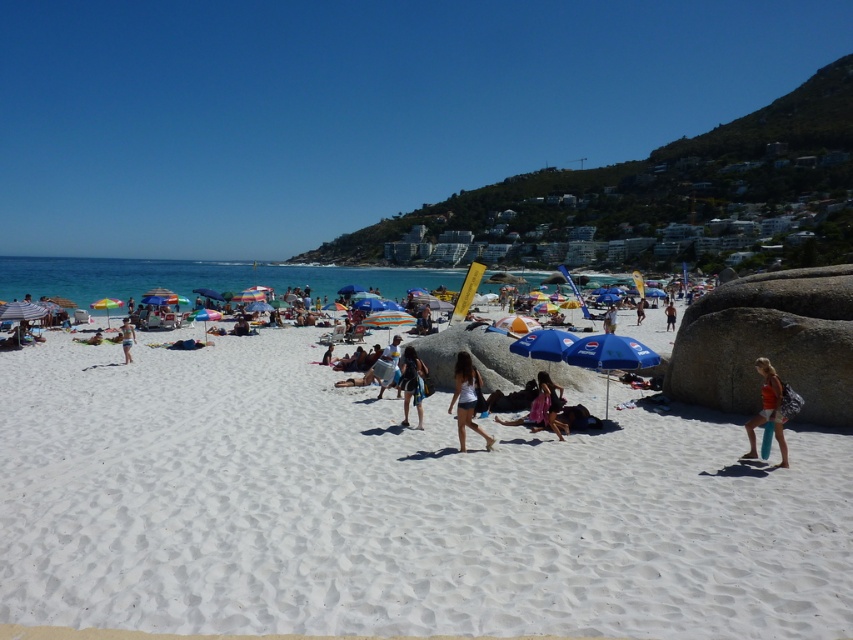
You are a photographer trying to capture a candid shot of the beachgoers. You notice the white cotton shirt at center and the dark blue shorts at center. Which clothing item would require a closer focus to capture details clearly?

The white cotton shirt at center occupies less space than the dark blue shorts at center, so you would need to focus closer on the white cotton shirt at center to capture its details clearly.

You are a photographer trying to capture a candid shot of the beachgoers. You notice the white cotton shirt at center and the dark blue shorts at center. Which object should you focus on to ensure it fits entirely within your camera frame if your frame can only accommodate the height of the shorter object?

The white cotton shirt at center is not as tall as dark blue shorts at center, so you should focus on the white cotton shirt at center to ensure it fits within the camera frame.